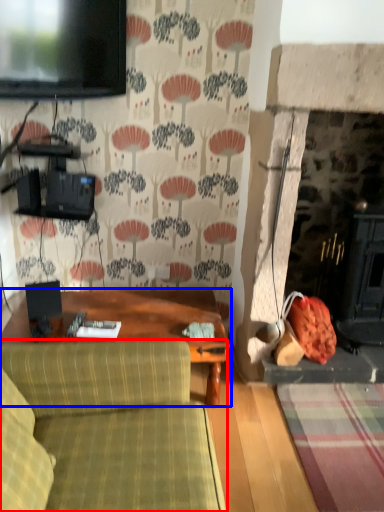
Question: Which point is further to the camera, studio couch (highlighted by a red box) or table (highlighted by a blue box)?

Choices:
 (A) studio couch
 (B) table

Answer: (B)